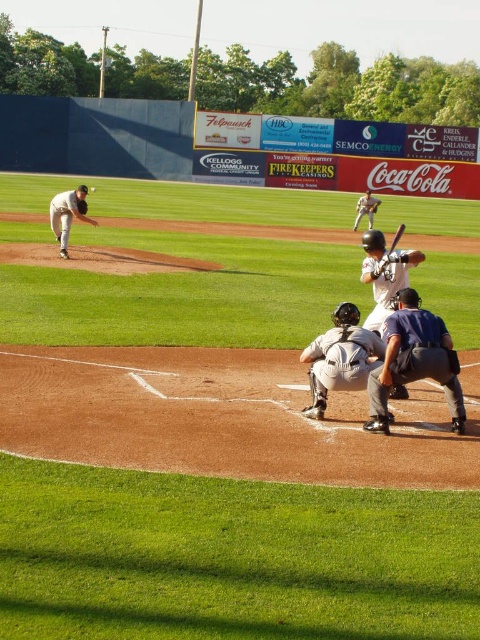
Question: Estimate the real-world distances between objects in this image. Which object is closer to the white uniformed pitcher at left?

Choices:
 (A) wooden bat at center
 (B) white jersey baseball player at center

Answer: (A)

Question: Does matte white bat at center appear over white jersey baseball player at center?

Choices:
 (A) yes
 (B) no

Answer: (B)

Question: Is matte white bat at center to the right of wooden baseball bat at center from the viewer's perspective?

Choices:
 (A) no
 (B) yes

Answer: (A)

Question: Does wooden bat at center appear over white matte baseball at center?

Choices:
 (A) yes
 (B) no

Answer: (B)

Question: Which point is farther to the camera?

Choices:
 (A) (357, 211)
 (B) (394, 252)
 (C) (95, 189)
 (D) (405, 227)

Answer: (C)

Question: Among these objects, which one is farthest from the camera?

Choices:
 (A) wooden bat at center
 (B) wooden baseball bat at center
 (C) white matte baseball at center
 (D) white jersey baseball player at center

Answer: (C)